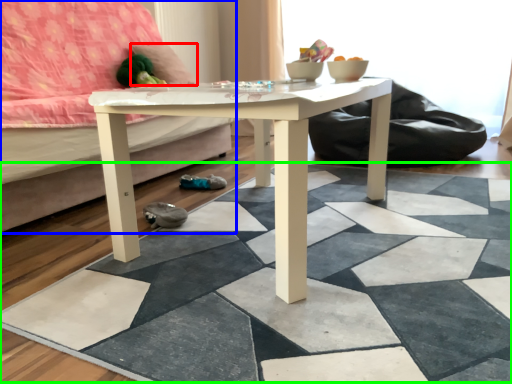
Question: Which object is the farthest from pillow (highlighted by a red box)? Choose among these: studio couch (highlighted by a blue box) or tile (highlighted by a green box).

Choices:
 (A) studio couch
 (B) tile

Answer: (B)